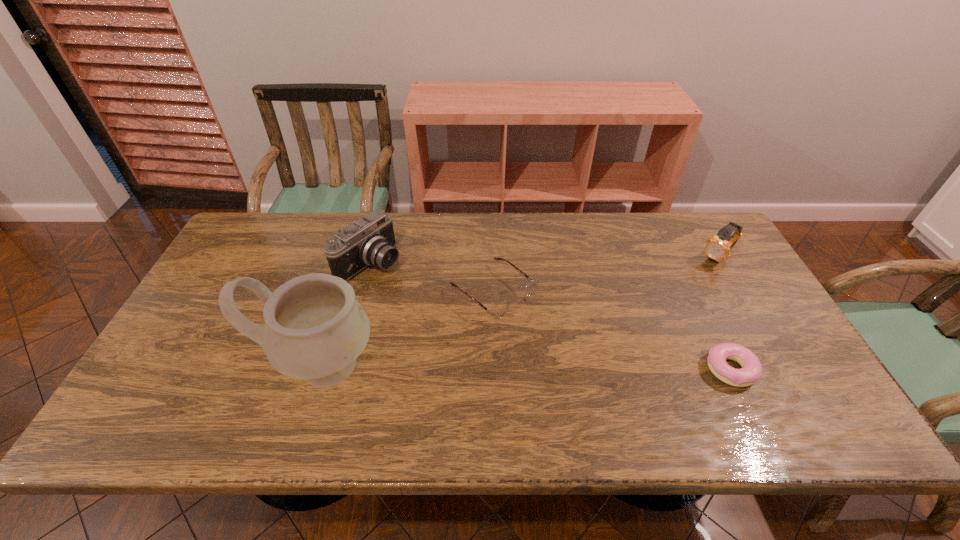
The height and width of the screenshot is (540, 960). Find the location of `camera present at the far edge`. camera present at the far edge is located at coordinates (370, 241).

Locate an element on the screen. This screenshot has height=540, width=960. pottery located in the near edge section of the desktop is located at coordinates pos(315,329).

You are a GUI agent. You are given a task and a screenshot of the screen. Output one action in this format:
    pyautogui.click(x=<x>, y=<y>)
    Task: Click on the doughnut present at the near edge
    The width and height of the screenshot is (960, 540).
    Given the screenshot: What is the action you would take?
    pyautogui.click(x=751, y=371)

Find the location of a particular element. The height and width of the screenshot is (540, 960). doughnut present at the right edge is located at coordinates (751, 371).

I want to click on watch positioned at the right edge, so click(x=718, y=247).

You are a GUI agent. You are given a task and a screenshot of the screen. Output one action in this format:
    pyautogui.click(x=<x>, y=<y>)
    Task: Click on the object that is at the far right corner
    
    Given the screenshot: What is the action you would take?
    pyautogui.click(x=718, y=247)

Locate an element on the screen. The height and width of the screenshot is (540, 960). object that is at the near right corner is located at coordinates pyautogui.click(x=751, y=371).

Locate an element on the screen. This screenshot has width=960, height=540. free region at the far edge of the desktop is located at coordinates (466, 237).

You are a GUI agent. You are given a task and a screenshot of the screen. Output one action in this format:
    pyautogui.click(x=<x>, y=<y>)
    Task: Click on the free region at the near edge of the desktop
    
    Given the screenshot: What is the action you would take?
    pyautogui.click(x=256, y=376)

This screenshot has width=960, height=540. In the image, there is a desktop. In order to click on free space at the left edge in this screenshot , I will do point(244,304).